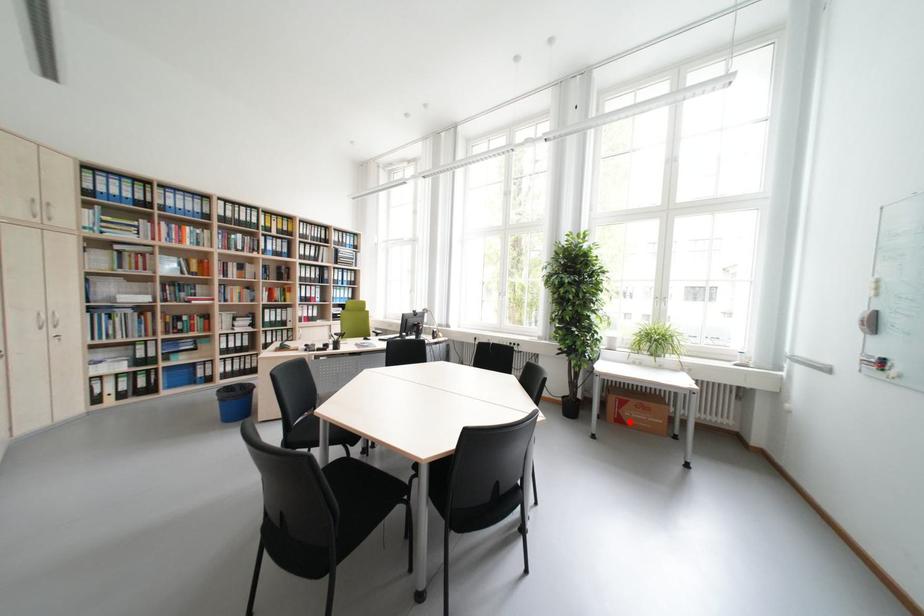
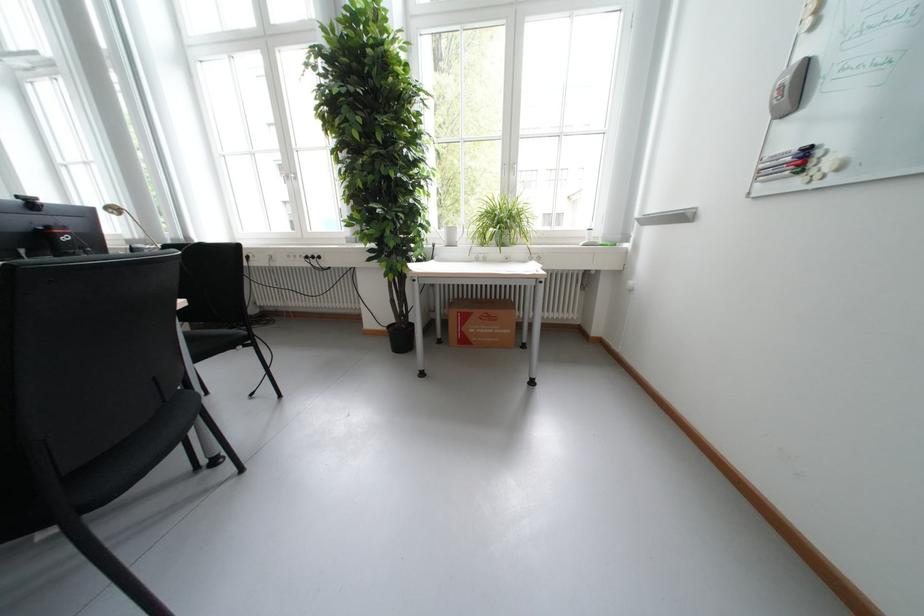
Question: I am providing you with two images of the same scene from different viewpoints. Given a red point in image1, look at the same physical point in image2. Is it:

Choices:
 (A) Closer to the viewpoint
 (B) Farther from the viewpoint

Answer: (B)